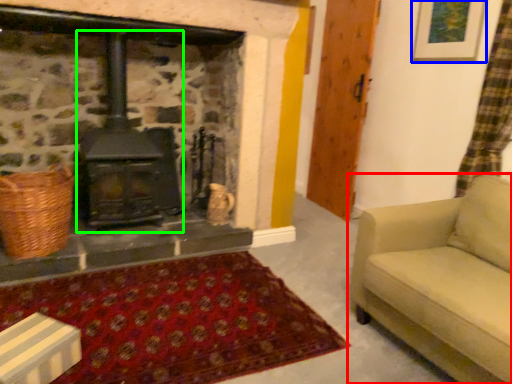
Question: Based on their relative distances, which object is nearer to studio couch (highlighted by a red box)? Choose from picture frame (highlighted by a blue box) and wood burning stove (highlighted by a green box).

Choices:
 (A) picture frame
 (B) wood burning stove

Answer: (A)